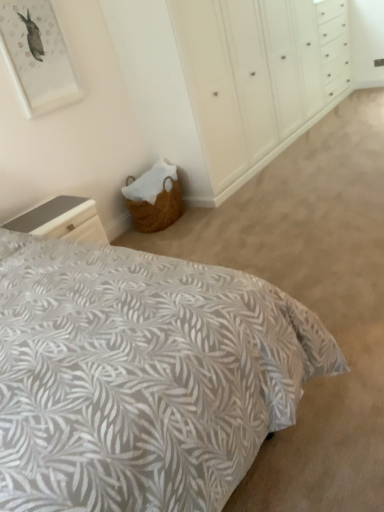
What do you see at coordinates (62, 220) in the screenshot?
I see `smooth gray nightstand at lower left` at bounding box center [62, 220].

Measure the distance between point (95,411) and camera.

Point (95,411) and camera are 93.60 centimeters apart from each other.

Find the location of a particular element. This screenshot has width=384, height=512. leaf-patterned fabric bed at lower left is located at coordinates (141, 376).

Describe the element at coordinates (37, 56) in the screenshot. The width and height of the screenshot is (384, 512). I see `matte white picture frame at upper left` at that location.

Find the location of a particular element. This screenshot has width=384, height=512. smooth gray nightstand at lower left is located at coordinates (62, 220).

Could you measure the distance between leaf-patterned fabric bed at lower left and matte white picture frame at upper left?

The distance of leaf-patterned fabric bed at lower left from matte white picture frame at upper left is 5.94 feet.

Does leaf-patterned fabric bed at lower left come in front of matte white picture frame at upper left?

Yes, it is.

Considering the points (112, 281) and (20, 58), which point is in front, point (112, 281) or point (20, 58)?

Point (112, 281)

In terms of height, does leaf-patterned fabric bed at lower left look taller or shorter compared to matte white picture frame at upper left?

In the image, leaf-patterned fabric bed at lower left appears to be shorter than matte white picture frame at upper left.

From the picture: How far apart are matte white picture frame at upper left and smooth gray nightstand at lower left?

matte white picture frame at upper left and smooth gray nightstand at lower left are 34.78 inches apart from each other.

Would you say matte white picture frame at upper left is to the left or to the right of smooth gray nightstand at lower left in the picture?

In the image, matte white picture frame at upper left appears on the left side of smooth gray nightstand at lower left.

Looking at the image, does matte white picture frame at upper left seem bigger or smaller compared to smooth gray nightstand at lower left?

matte white picture frame at upper left is smaller than smooth gray nightstand at lower left.

Are matte white picture frame at upper left and smooth gray nightstand at lower left making contact?

No, matte white picture frame at upper left is not in contact with smooth gray nightstand at lower left.

Consider the image. From a real-world perspective, is woven basket at lower left located beneath smooth gray nightstand at lower left?

No.

Is point (266, 95) closer to camera compared to point (49, 223)?

No, it is behind (49, 223).

From the image's perspective, is woven basket at lower left under smooth gray nightstand at lower left?

No, from the image's perspective, woven basket at lower left is not beneath smooth gray nightstand at lower left.

Is woven basket at lower left wider than smooth gray nightstand at lower left?

Yes, woven basket at lower left is wider than smooth gray nightstand at lower left.

Is smooth gray nightstand at lower left in front of or behind woven basket at lower left in the image?

smooth gray nightstand at lower left is positioned closer to the viewer than woven basket at lower left.

Is there a large distance between smooth gray nightstand at lower left and woven basket at lower left?

Yes.

Can you tell me how much smooth gray nightstand at lower left and woven basket at lower left differ in facing direction?

smooth gray nightstand at lower left and woven basket at lower left are facing 0.851 degrees away from each other.

In the scene shown: Is smooth gray nightstand at lower left aimed at woven basket at lower left?

No, smooth gray nightstand at lower left is not facing towards woven basket at lower left.

Who is more distant, matte white picture frame at upper left or leaf-patterned fabric bed at lower left?

Positioned behind is matte white picture frame at upper left.

Considering the points (21, 14) and (182, 480), which point is in front, point (21, 14) or point (182, 480)?

Positioned in front is point (182, 480).

From a real-world perspective, is matte white picture frame at upper left physically above leaf-patterned fabric bed at lower left?

Correct, in the physical world, matte white picture frame at upper left is higher than leaf-patterned fabric bed at lower left.

Can you tell me how much matte white picture frame at upper left and leaf-patterned fabric bed at lower left differ in facing direction?

matte white picture frame at upper left and leaf-patterned fabric bed at lower left are facing 0.00121 degrees away from each other.

How many degrees apart are the facing directions of leaf-patterned fabric bed at lower left and smooth gray nightstand at lower left?

leaf-patterned fabric bed at lower left and smooth gray nightstand at lower left are facing 1.22 degrees away from each other.

From the image's perspective, who appears lower, leaf-patterned fabric bed at lower left or smooth gray nightstand at lower left?

smooth gray nightstand at lower left, from the image's perspective.

Between leaf-patterned fabric bed at lower left and smooth gray nightstand at lower left, which one has smaller size?

With smaller size is smooth gray nightstand at lower left.

From a real-world perspective, does leaf-patterned fabric bed at lower left stand above smooth gray nightstand at lower left?

No, from a real-world perspective, leaf-patterned fabric bed at lower left is not above smooth gray nightstand at lower left.

From a real-world perspective, is smooth gray nightstand at lower left positioned over leaf-patterned fabric bed at lower left based on gravity?

Indeed, from a real-world perspective, smooth gray nightstand at lower left stands above leaf-patterned fabric bed at lower left.

The height and width of the screenshot is (512, 384). I want to click on bed that is on the right side of smooth gray nightstand at lower left, so click(x=141, y=376).

From the image's perspective, which object appears higher, smooth gray nightstand at lower left or leaf-patterned fabric bed at lower left?

From the image's view, leaf-patterned fabric bed at lower left is above.

You are a GUI agent. You are given a task and a screenshot of the screen. Output one action in this format:
    pyautogui.click(x=<x>, y=<y>)
    Task: Click on the bed on the right of matte white picture frame at upper left
    
    Given the screenshot: What is the action you would take?
    pyautogui.click(x=141, y=376)

This screenshot has width=384, height=512. Identify the location of picture frame that is on the left side of smooth gray nightstand at lower left. 37,56.

Based on the photo, when comparing their distances from smooth gray nightstand at lower left, does matte white picture frame at upper left or woven basket at lower left seem further?

The object further to smooth gray nightstand at lower left is woven basket at lower left.

Based on their spatial positions, is smooth gray nightstand at lower left or woven basket at lower left further from leaf-patterned fabric bed at lower left?

woven basket at lower left is positioned further to the anchor leaf-patterned fabric bed at lower left.

Looking at the image, which one is located further to leaf-patterned fabric bed at lower left, matte white picture frame at upper left or smooth gray nightstand at lower left?

matte white picture frame at upper left lies further to leaf-patterned fabric bed at lower left than the other object.

Looking at the image, which one is located closer to woven basket at lower left, leaf-patterned fabric bed at lower left or smooth gray nightstand at lower left?

smooth gray nightstand at lower left lies closer to woven basket at lower left than the other object.

From the image, which object appears to be farther from leaf-patterned fabric bed at lower left, woven basket at lower left or matte white picture frame at upper left?

The object further to leaf-patterned fabric bed at lower left is woven basket at lower left.

Considering their positions, is woven basket at lower left positioned closer to leaf-patterned fabric bed at lower left than smooth gray nightstand at lower left?

smooth gray nightstand at lower left is closer to leaf-patterned fabric bed at lower left.

When comparing their distances from matte white picture frame at upper left, does smooth gray nightstand at lower left or leaf-patterned fabric bed at lower left seem closer?

The object closer to matte white picture frame at upper left is smooth gray nightstand at lower left.

Looking at the image, which one is located further to matte white picture frame at upper left, woven basket at lower left or leaf-patterned fabric bed at lower left?

leaf-patterned fabric bed at lower left lies further to matte white picture frame at upper left than the other object.

Where is `nightstand situated between matte white picture frame at upper left and leaf-patterned fabric bed at lower left from left to right`? nightstand situated between matte white picture frame at upper left and leaf-patterned fabric bed at lower left from left to right is located at coordinates click(62, 220).

Find the location of a particular element. The height and width of the screenshot is (512, 384). picture frame between woven basket at lower left and smooth gray nightstand at lower left in the up-down direction is located at coordinates (37, 56).

Identify the location of dresser between matte white picture frame at upper left and leaf-patterned fabric bed at lower left. (251, 81).

Where is `dresser between smooth gray nightstand at lower left and leaf-patterned fabric bed at lower left from left to right`? The height and width of the screenshot is (512, 384). dresser between smooth gray nightstand at lower left and leaf-patterned fabric bed at lower left from left to right is located at coordinates (251, 81).